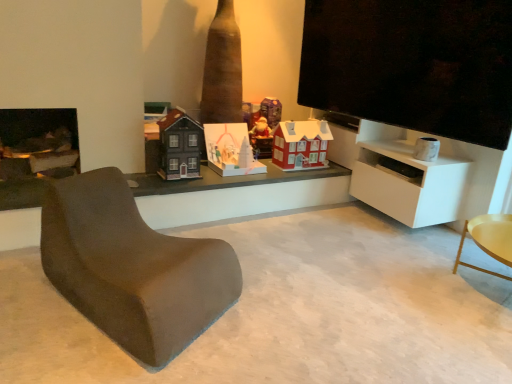
Where is `free point to the left of matte black house at center, marked as the first toy in a left-to-right arrangement`? Image resolution: width=512 pixels, height=384 pixels. free point to the left of matte black house at center, marked as the first toy in a left-to-right arrangement is located at coordinates (146, 174).